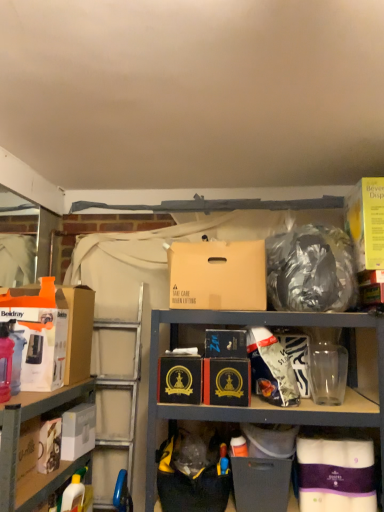
Question: Considering the positions of translucent plastic bottle at left and brown cardboard box at center, which is the fourth box in left-to-right order, in the image, is translucent plastic bottle at left wider or thinner than brown cardboard box at center, which is the fourth box in left-to-right order,?

Choices:
 (A) thin
 (B) wide

Answer: (A)

Question: Does point (1, 360) appear closer or farther from the camera than point (198, 244)?

Choices:
 (A) closer
 (B) farther

Answer: (A)

Question: Considering the real-world distances, which object is closest to the yellow cardboard beverage dispenser at upper right, which ranks as the 9th box in left-to-right order?

Choices:
 (A) white matte box at lower left, the eighth box viewed from the right
 (B) translucent plastic bottle at left
 (C) black plastic bag at lower center, which is the 1th garbage in bottom-to-top order
 (D) black cardboard box at center, the fifth box when ordered from left to right
 (E) shiny metallic bag at upper right, which is the 1th garbage from top to bottom

Answer: (E)

Question: Estimate the real-world distances between objects in this image. Which object is closer to the shiny metallic bag at upper right, which appears as the second garbage when ordered from the bottom?

Choices:
 (A) matte black box at lower center, which is the 3th box in right-to-left order
 (B) black cardboard box at center, which appears as the 7th box when viewed from the right
 (C) orange cardboard box at left, the ninth box viewed from the right
 (D) brown cardboard box at center, which is the fourth box in left-to-right order
 (E) white matte box at lower left, which is counted as the 2th box, starting from the left

Answer: (D)